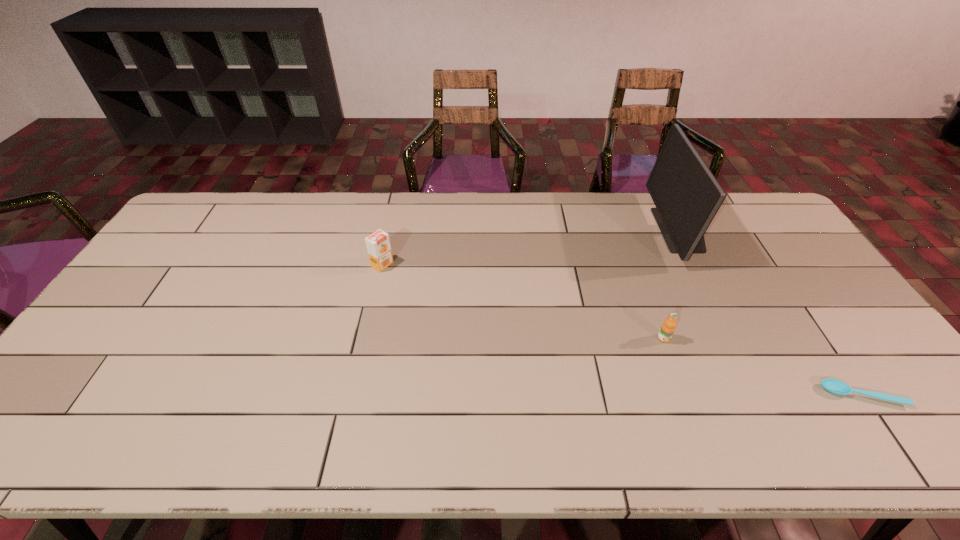
Select which object is the closest to the computer monitor. Please provide its 2D coordinates. Your answer should be formatted as a tuple, i.e. [(x, y)], where the tuple contains the x and y coordinates of a point satisfying the conditions above.

[(668, 327)]

Where is `object identified as the third closest to the taller orange juice`? The image size is (960, 540). object identified as the third closest to the taller orange juice is located at coordinates (835, 386).

Identify the location of free spot that satisfies the following two spatial constraints: 1. on the screen side of the nearest object; 2. on the right side of the tallest object. (764, 395).